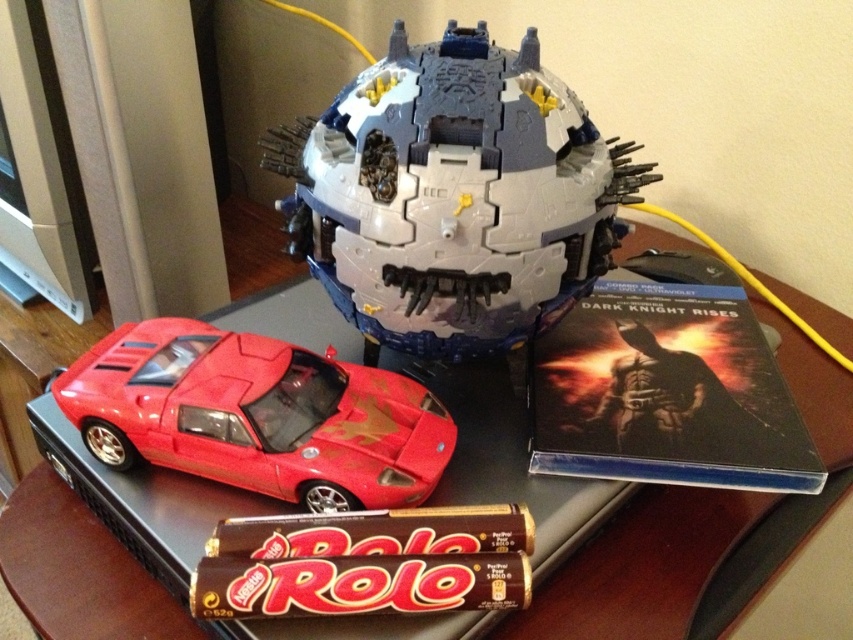
Question: Which point is farther from the camera taking this photo?

Choices:
 (A) (315, 236)
 (B) (93, 397)
 (C) (636, 502)

Answer: (C)

Question: Is plastic gray and blue robot head at center smaller than shiny black table at center?

Choices:
 (A) no
 (B) yes

Answer: (B)

Question: Which object is positioned closest to the plastic gray and blue robot head at center?

Choices:
 (A) shiny red car at lower left
 (B) shiny black table at center

Answer: (A)

Question: Which object is farther from the camera taking this photo?

Choices:
 (A) matte plastic dvd case at upper right
 (B) shiny red car at lower left
 (C) shiny black table at center

Answer: (A)

Question: Can you confirm if plastic gray and blue robot head at center is wider than shiny black table at center?

Choices:
 (A) yes
 (B) no

Answer: (B)

Question: Does plastic gray and blue robot head at center have a greater width compared to matte plastic dvd case at upper right?

Choices:
 (A) yes
 (B) no

Answer: (A)